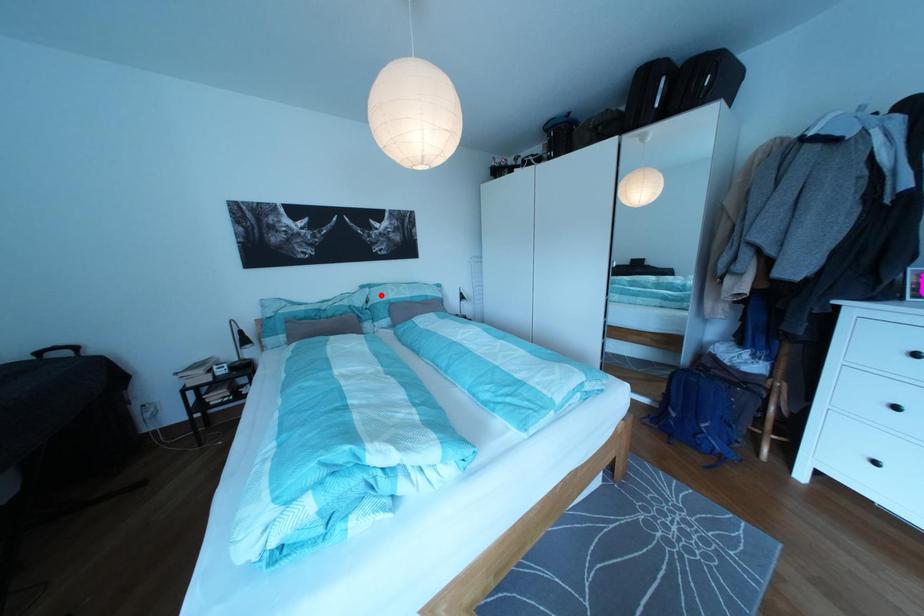
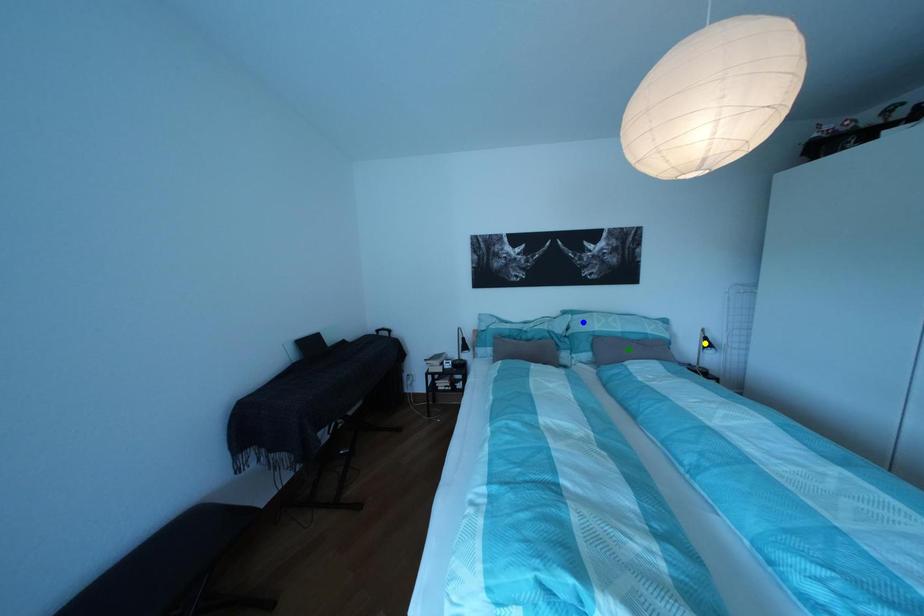
Question: I am providing you with two images of the same scene from different viewpoints. A red point is marked on the first image. You are given multiple points on the second image. Which point in image 2 is actually the same real-world point as the red point in image 1?

Choices:
 (A) blue point
 (B) yellow point
 (C) green point

Answer: (A)